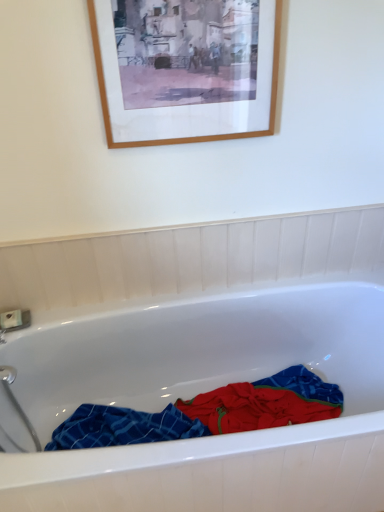
Question: From a real-world perspective, is white glossy bathtub at center physically below blue plaid towel at center?

Choices:
 (A) yes
 (B) no

Answer: (B)

Question: Is blue plaid towel at center at the back of white glossy bathtub at center?

Choices:
 (A) no
 (B) yes

Answer: (B)

Question: Considering the relative positions of white glossy bathtub at center and blue plaid towel at center in the image provided, is white glossy bathtub at center to the left of blue plaid towel at center from the viewer's perspective?

Choices:
 (A) yes
 (B) no

Answer: (B)

Question: Can you confirm if white glossy bathtub at center is shorter than blue plaid towel at center?

Choices:
 (A) no
 (B) yes

Answer: (A)

Question: From a real-world perspective, does white glossy bathtub at center stand above blue plaid towel at center?

Choices:
 (A) no
 (B) yes

Answer: (B)

Question: Does white glossy bathtub at center appear on the right side of blue plaid towel at center?

Choices:
 (A) no
 (B) yes

Answer: (B)

Question: Is blue plaid towel at center placed right next to wooden picture frame at upper center?

Choices:
 (A) no
 (B) yes

Answer: (A)

Question: Does blue plaid towel at center contain wooden picture frame at upper center?

Choices:
 (A) yes
 (B) no

Answer: (B)

Question: Does blue plaid towel at center have a greater width compared to wooden picture frame at upper center?

Choices:
 (A) yes
 (B) no

Answer: (A)

Question: Is blue plaid towel at center far away from wooden picture frame at upper center?

Choices:
 (A) yes
 (B) no

Answer: (A)

Question: Is blue plaid towel at center to the right of wooden picture frame at upper center from the viewer's perspective?

Choices:
 (A) yes
 (B) no

Answer: (A)

Question: Does blue plaid towel at center have a smaller size compared to wooden picture frame at upper center?

Choices:
 (A) no
 (B) yes

Answer: (A)

Question: Does white glossy bathtub at center have a lesser height compared to wooden picture frame at upper center?

Choices:
 (A) yes
 (B) no

Answer: (B)